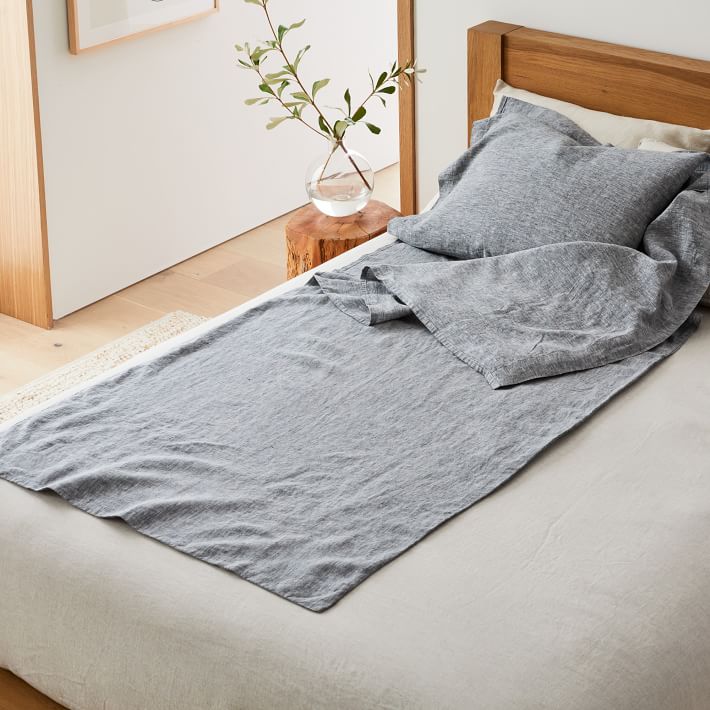
Where is `picture frame`? This screenshot has height=710, width=710. picture frame is located at coordinates (72, 20), (121, 38), (216, 9).